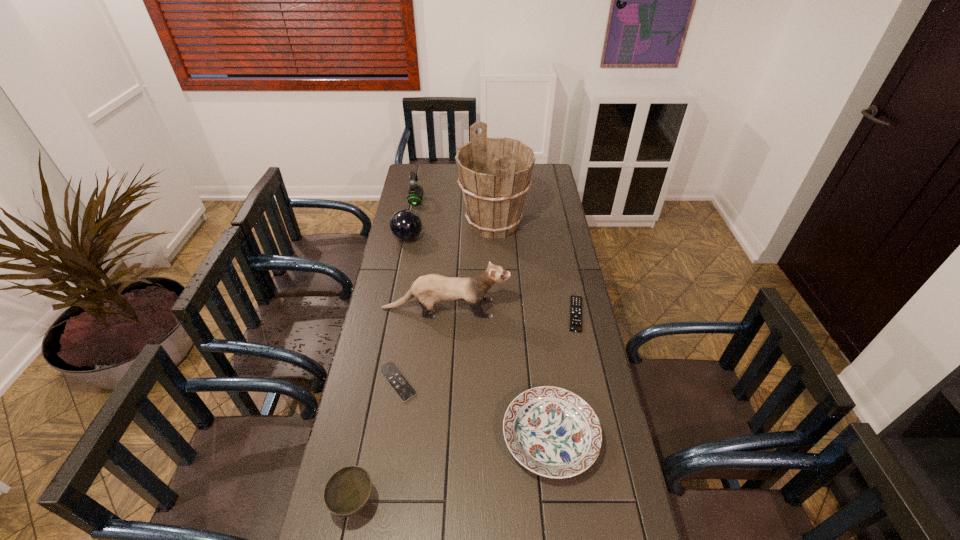
Identify the location of vacant space in between the fifth tallest object and the headset. (385, 352).

Where is `vacant space that's between the tallest object and the farther remote control`? vacant space that's between the tallest object and the farther remote control is located at coordinates (535, 269).

Locate an element on the screen. Image resolution: width=960 pixels, height=540 pixels. unoccupied area between the nearer remote control and the bucket is located at coordinates (445, 303).

The height and width of the screenshot is (540, 960). Find the location of `empty space between the bowl and the tallest object`. empty space between the bowl and the tallest object is located at coordinates [423, 363].

Identify the location of empty space between the third shortest object and the taller remote control. (564, 375).

Locate an element on the screen. This screenshot has width=960, height=540. free spot between the headset and the bowl is located at coordinates (385, 352).

Locate an element on the screen. free space between the bowling ball and the tallest object is located at coordinates (450, 231).

At what (x,y) coordinates should I click in order to perform the action: click on blank region between the bowling ball and the sixth tallest object. Please return your answer as a coordinate pair (x, y). The width and height of the screenshot is (960, 540). Looking at the image, I should click on (479, 338).

Locate an element on the screen. Image resolution: width=960 pixels, height=540 pixels. free space that is in between the bowling ball and the shortest object is located at coordinates (402, 310).

Point out which object is positioned as the sixth nearest to the fourth shortest object. Please provide its 2D coordinates. Your answer should be formatted as a tuple, i.e. [(x, y)], where the tuple contains the x and y coordinates of a point satisfying the conditions above.

[(494, 174)]